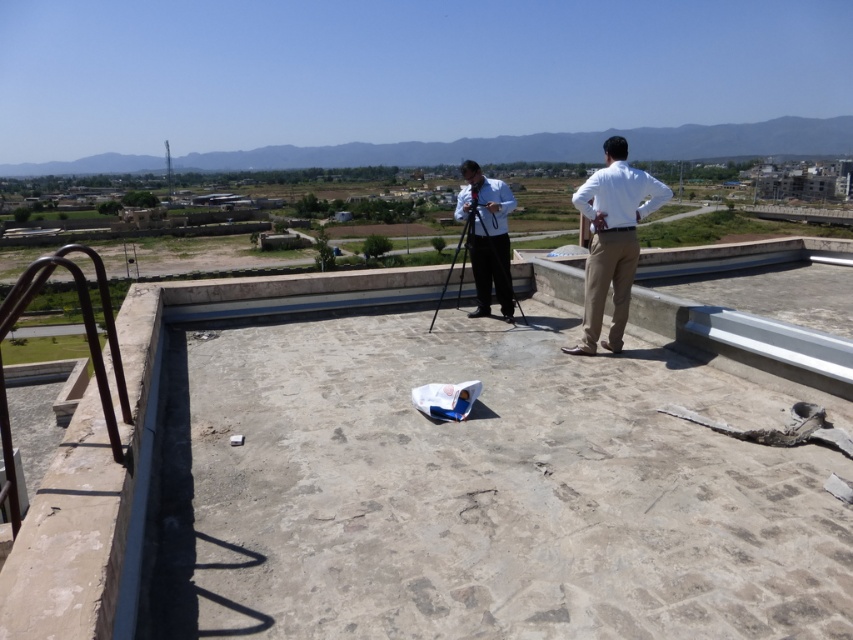
You are standing on the rooftop and want to place a small potted plant at the point marked as point (612,241). However, you must ensure it doesn not obstruct the white cotton shirt at right. Is the chosen location safe?

The point (612,241) is on the white cotton shirt at right, so placing the potted plant there would obstruct the white cotton shirt at right. Choose another location.

You are a photographer trying to capture a clear image of both the white cotton shirt at right and the metallic tripod at center. Which object should you focus on first if you want to ensure both are in focus?

The white cotton shirt at right is not as tall as the metallic tripod at center, so you should focus on the metallic tripod at center first to ensure both are in focus.